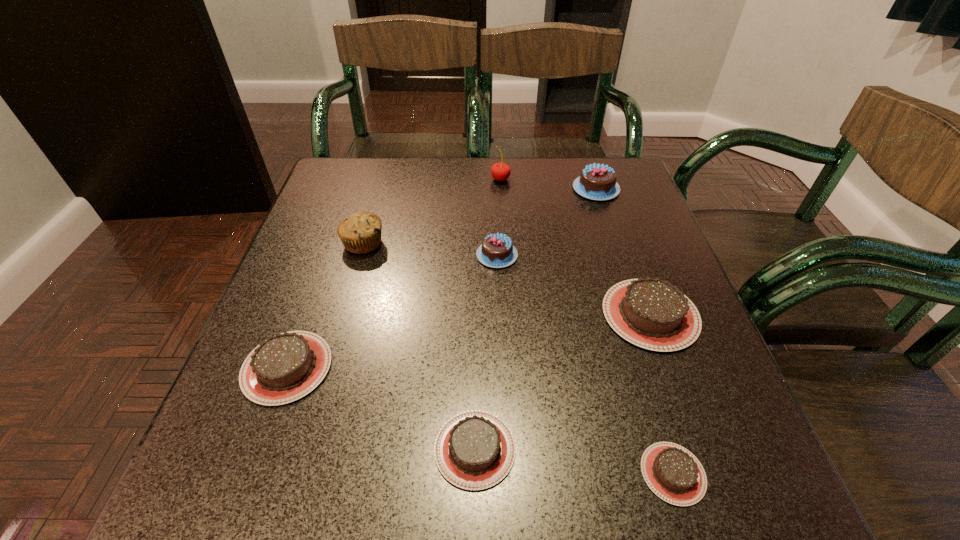
In order to click on vacant region at the right edge of the desktop in this screenshot , I will do `click(632, 224)`.

Where is `free space at the far left corner of the desktop`? free space at the far left corner of the desktop is located at coordinates [x=337, y=201].

This screenshot has width=960, height=540. In order to click on vacant space at the near left corner of the desktop in this screenshot , I will do `click(198, 501)`.

Image resolution: width=960 pixels, height=540 pixels. I want to click on vacant area at the far right corner, so click(609, 160).

I want to click on vacant position at the near right corner of the desktop, so click(x=725, y=471).

I want to click on empty space that is in between the tallest object and the muffin, so click(x=432, y=211).

Locate an element on the screen. vacant region between the muffin and the shortest object is located at coordinates (518, 359).

Find the location of a particular element. The height and width of the screenshot is (540, 960). vacant space that is in between the smaller pink chocolate cake and the second shortest object is located at coordinates (486, 352).

Image resolution: width=960 pixels, height=540 pixels. I want to click on vacant point located between the tallest object and the third smallest brown chocolate cake, so click(394, 273).

At what (x,y) coordinates should I click in order to perform the action: click on free spot between the tallest chocolate cake and the third shortest object. Please return your answer as a coordinate pair (x, y). This screenshot has width=960, height=540. Looking at the image, I should click on (442, 278).